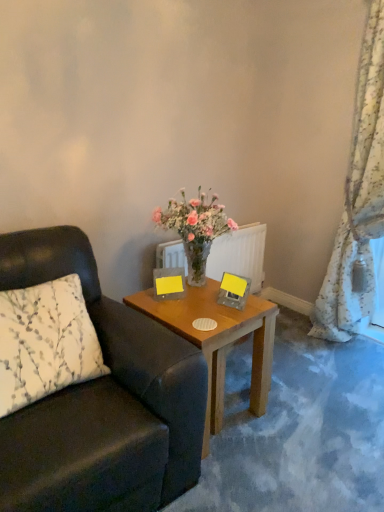
Question: Does matte yellow picture frame at upper center, the 2th picture frame viewed from the right, have a smaller size compared to yellow paper at center, the 1th picture frame when ordered from right to left?

Choices:
 (A) yes
 (B) no

Answer: (A)

Question: Is matte yellow picture frame at upper center, the first picture frame from the left, next to yellow paper at center, placed as the second picture frame when sorted from left to right?

Choices:
 (A) no
 (B) yes

Answer: (A)

Question: Considering the relative sizes of matte yellow picture frame at upper center, the first picture frame from the left, and yellow paper at center, placed as the second picture frame when sorted from left to right, in the image provided, is matte yellow picture frame at upper center, the first picture frame from the left, taller than yellow paper at center, placed as the second picture frame when sorted from left to right,?

Choices:
 (A) yes
 (B) no

Answer: (B)

Question: Can you confirm if matte yellow picture frame at upper center, the 2th picture frame viewed from the right, is bigger than yellow paper at center, placed as the second picture frame when sorted from left to right?

Choices:
 (A) yes
 (B) no

Answer: (B)

Question: Could you tell me if matte yellow picture frame at upper center, the 2th picture frame viewed from the right, is facing yellow paper at center, the 1th picture frame when ordered from right to left?

Choices:
 (A) yes
 (B) no

Answer: (B)

Question: From the image's perspective, relative to floral fabric curtain at right, is leather cushion at left above or below?

Choices:
 (A) above
 (B) below

Answer: (B)

Question: Considering the positions of point (74, 250) and point (382, 86), is point (74, 250) closer or farther from the camera than point (382, 86)?

Choices:
 (A) farther
 (B) closer

Answer: (B)

Question: Is leather cushion at left taller or shorter than floral fabric curtain at right?

Choices:
 (A) tall
 (B) short

Answer: (B)

Question: From a real-world perspective, is leather cushion at left physically located above or below floral fabric curtain at right?

Choices:
 (A) below
 (B) above

Answer: (A)

Question: From the image's perspective, relative to matte yellow picture frame at upper center, the 2th picture frame viewed from the right, is wooden table at center above or below?

Choices:
 (A) below
 (B) above

Answer: (A)

Question: Does point (215, 347) appear closer or farther from the camera than point (168, 286)?

Choices:
 (A) closer
 (B) farther

Answer: (A)

Question: Considering the positions of wooden table at center and matte yellow picture frame at upper center, the first picture frame from the left, in the image, is wooden table at center wider or thinner than matte yellow picture frame at upper center, the first picture frame from the left,?

Choices:
 (A) thin
 (B) wide

Answer: (B)

Question: Is wooden table at center spatially inside matte yellow picture frame at upper center, the first picture frame from the left, or outside of it?

Choices:
 (A) outside
 (B) inside

Answer: (A)

Question: In the image, is yellow paper at center, placed as the second picture frame when sorted from left to right, positioned in front of or behind white printed fabric pillow at left?

Choices:
 (A) behind
 (B) front

Answer: (A)

Question: In terms of width, does yellow paper at center, the 1th picture frame when ordered from right to left, look wider or thinner when compared to white printed fabric pillow at left?

Choices:
 (A) wide
 (B) thin

Answer: (B)